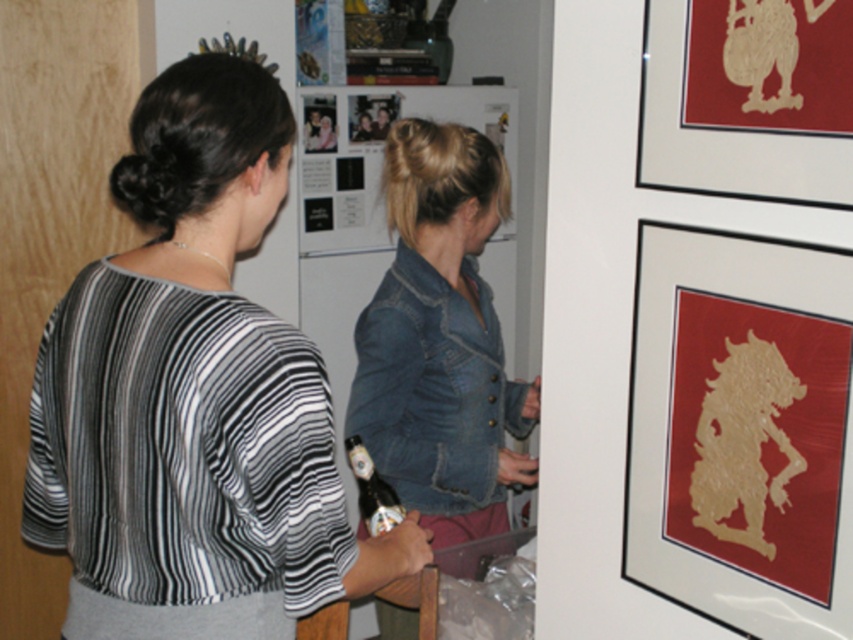
Question: Which point is farther to the camera?

Choices:
 (A) (799, 67)
 (B) (114, 298)

Answer: (B)

Question: Is gold paper silhouette at upper right thinner than gold textured paper at upper right?

Choices:
 (A) yes
 (B) no

Answer: (B)

Question: Can you confirm if striped fabric blouse at left is thinner than gold paper silhouette at upper right?

Choices:
 (A) yes
 (B) no

Answer: (B)

Question: Which point is farther to the camera?

Choices:
 (A) gold textured paper at upper right
 (B) gold paper silhouette at upper right

Answer: (B)

Question: Estimate the real-world distances between objects in this image. Which object is closer to the striped fabric blouse at left?

Choices:
 (A) gold textured paper at upper right
 (B) gold paper silhouette at upper right

Answer: (B)

Question: Can you confirm if striped fabric blouse at left is positioned to the left of gold paper silhouette at upper right?

Choices:
 (A) yes
 (B) no

Answer: (A)